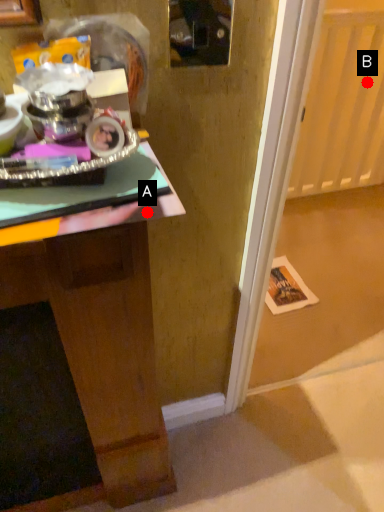
Question: Two points are circled on the image, labeled by A and B beside each circle. Among these points, which one is nearest to the camera?

Choices:
 (A) A is closer
 (B) B is closer

Answer: (A)